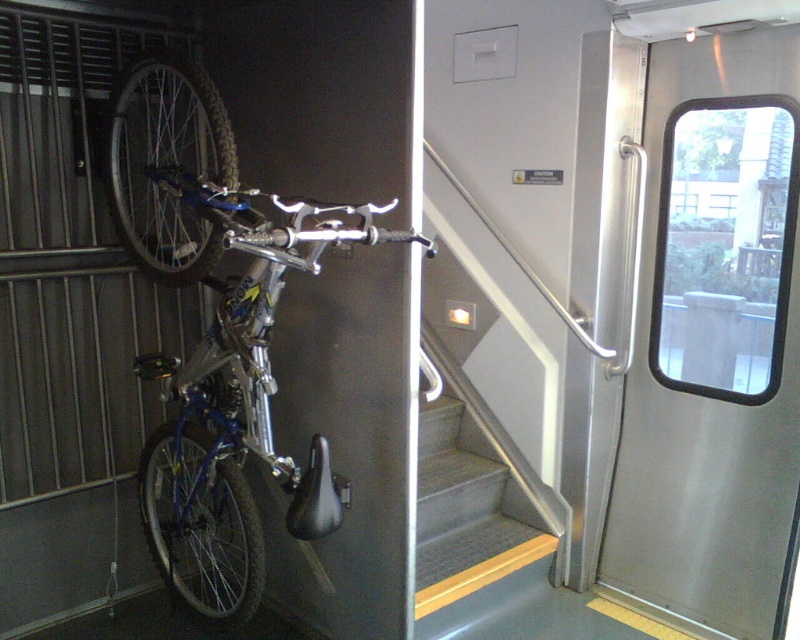
You are a passenger trying to exit the train. You see a polished stainless steel door at right and gray carpeted stairs at center. Which exit is larger in size?

The polished stainless steel door at right is bigger than gray carpeted stairs at center, so the polished stainless steel door at right is the larger exit.

You are a passenger trying to board the train and see the blue metallic bicycle at left and the gray carpeted stairs at center. Which object is bigger in size?

The blue metallic bicycle at left is larger in size than the gray carpeted stairs at center.

You are a passenger standing at the polished stainless steel door at right and want to take a photo of the camera with your phone. Can you reach the camera from your current position without moving your feet?

The polished stainless steel door at right and camera are 8.07 feet apart from each other. Since the average person can reach about 2.5 feet, you cannot reach the camera from the polished stainless steel door at right without moving.